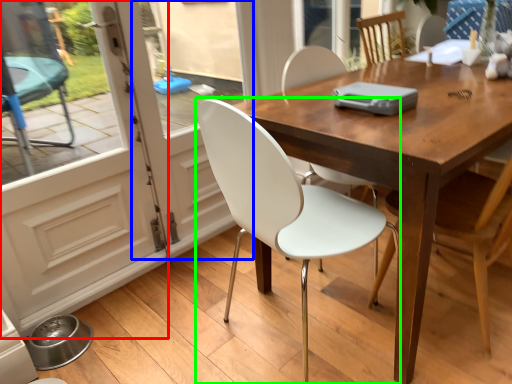
Question: Which object is the farthest from screen door (highlighted by a red box)? Choose among these: screen door (highlighted by a blue box) or chair (highlighted by a green box).

Choices:
 (A) screen door
 (B) chair

Answer: (B)